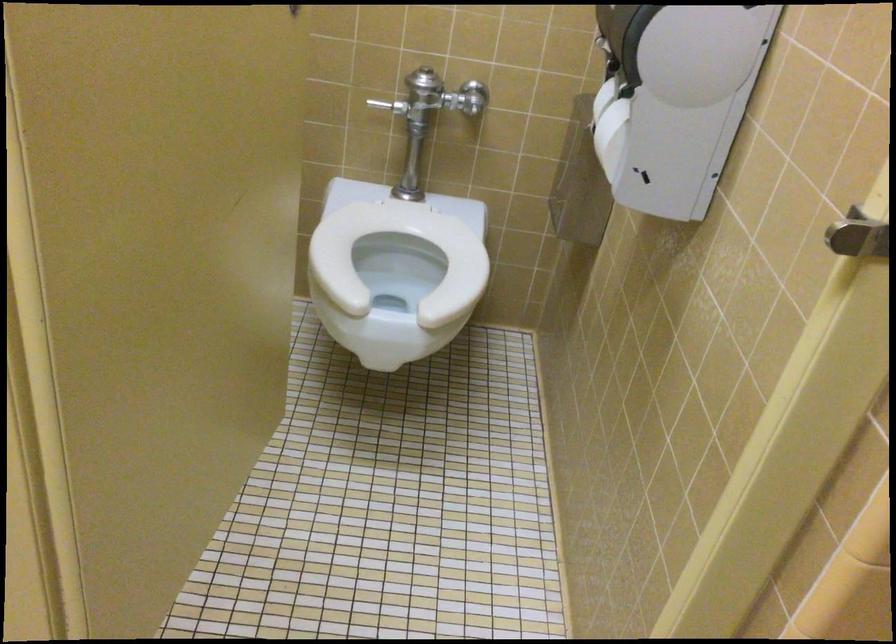
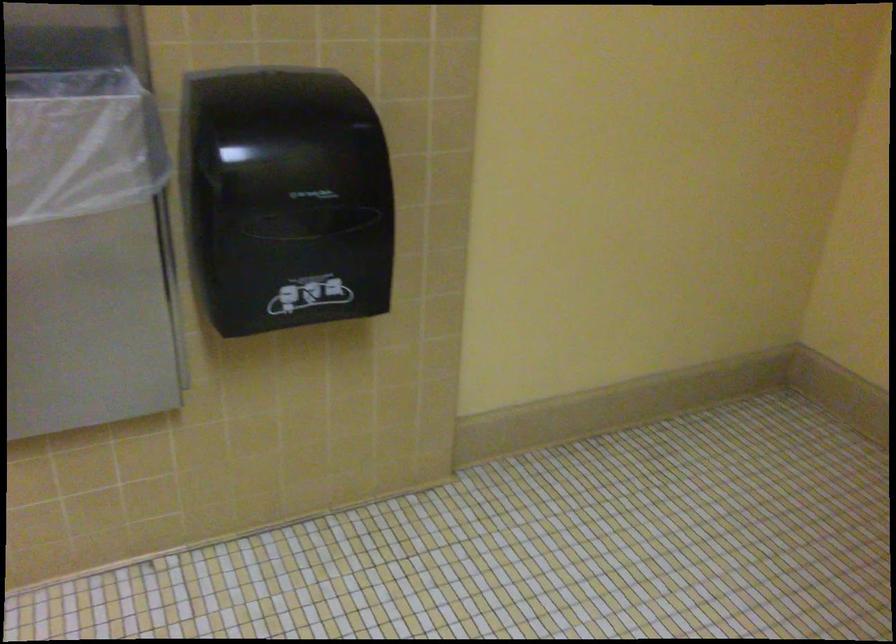
The first image is from the beginning of the video and the second image is from the end. How did the camera likely rotate when shooting the video?

The camera rotated toward right-down.